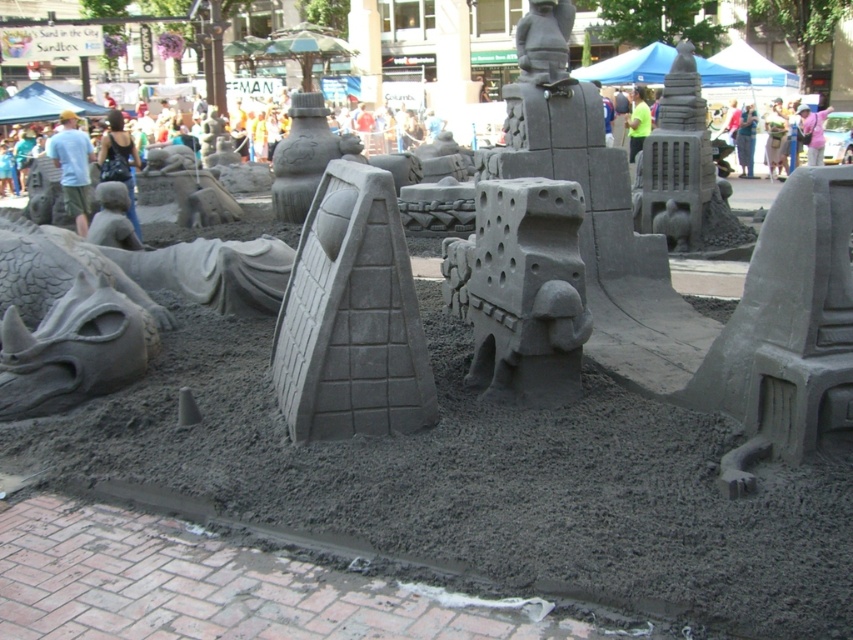
Question: Is gray sandcastle at center further to camera compared to gray matte sand sculpture at lower left?

Choices:
 (A) no
 (B) yes

Answer: (A)

Question: Which point is farther from the camera taking this photo?

Choices:
 (A) (100, 284)
 (B) (733, 220)

Answer: (B)

Question: Which point is farther to the camera?

Choices:
 (A) (395, 355)
 (B) (463, 380)

Answer: (B)

Question: Is gray brick wall at center positioned before gray sandcastle at center?

Choices:
 (A) yes
 (B) no

Answer: (A)

Question: Which point is closer to the camera?

Choices:
 (A) gray brick wall at center
 (B) gray sandcastle at center

Answer: (A)

Question: Can you confirm if gray brick wall at center is positioned below gray matte sand sculpture at lower left?

Choices:
 (A) no
 (B) yes

Answer: (B)